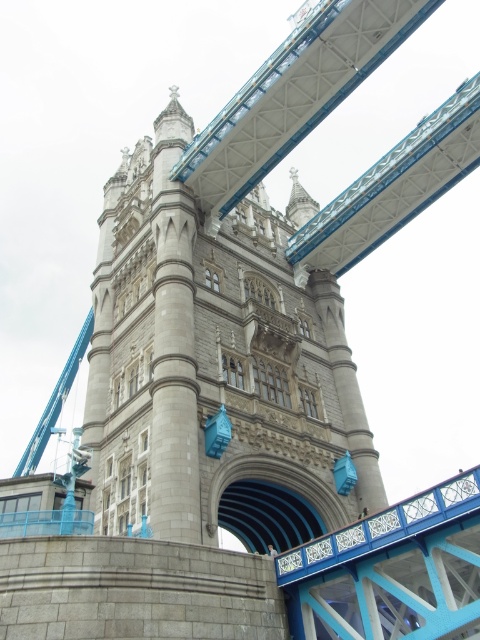
Question: Can you confirm if stone tower at center is bigger than smooth blue bridge at center?

Choices:
 (A) yes
 (B) no

Answer: (A)

Question: Which of the following is the closest to the observer?

Choices:
 (A) (118, 192)
 (B) (399, 522)

Answer: (B)

Question: Which object appears farthest from the camera in this image?

Choices:
 (A) smooth blue bridge at center
 (B) stone tower at center

Answer: (B)

Question: Observing the image, what is the correct spatial positioning of stone tower at center in reference to smooth blue bridge at center?

Choices:
 (A) left
 (B) right

Answer: (A)

Question: Can you confirm if stone tower at center is positioned above smooth blue bridge at center?

Choices:
 (A) no
 (B) yes

Answer: (B)

Question: Which point appears farthest from the camera in this image?

Choices:
 (A) (268, 368)
 (B) (452, 588)

Answer: (A)